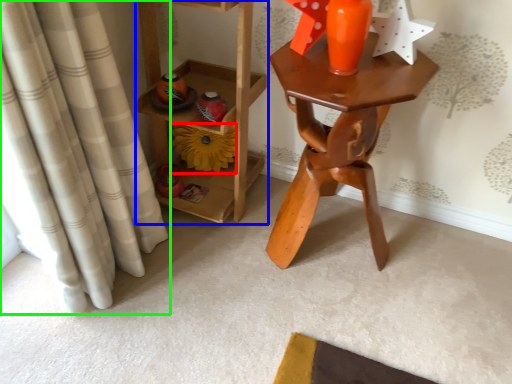
Question: Which object is positioned farthest from flower (highlighted by a red box)? Select from furniture (highlighted by a blue box) and curtain (highlighted by a green box).

Choices:
 (A) furniture
 (B) curtain

Answer: (B)